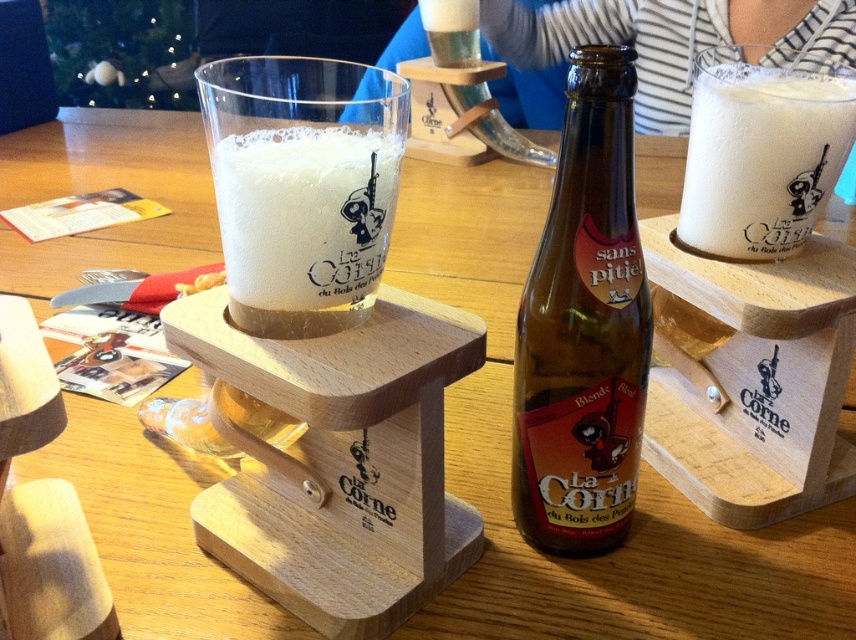
Question: Which point is closer to the camera?

Choices:
 (A) white frothy foam at upper right
 (B) clear glass beer glass at center
 (C) white frothy foam at center
 (D) brown glass bottle at center

Answer: (B)

Question: Where is white frothy foam at center located in relation to striped fabric shirt at upper center in the image?

Choices:
 (A) above
 (B) below

Answer: (B)

Question: Does white frothy foam at center appear on the right side of striped fabric shirt at upper center?

Choices:
 (A) yes
 (B) no

Answer: (B)

Question: Which point is closer to the camera taking this photo?

Choices:
 (A) (336, 134)
 (B) (682, 106)
 (C) (610, 508)

Answer: (A)

Question: Which of the following is the closest to the observer?

Choices:
 (A) white frothy foam at upper right
 (B) striped fabric shirt at upper center
 (C) clear glass beer glass at center

Answer: (C)

Question: Is clear glass beer glass at center in front of striped fabric shirt at upper center?

Choices:
 (A) no
 (B) yes

Answer: (B)